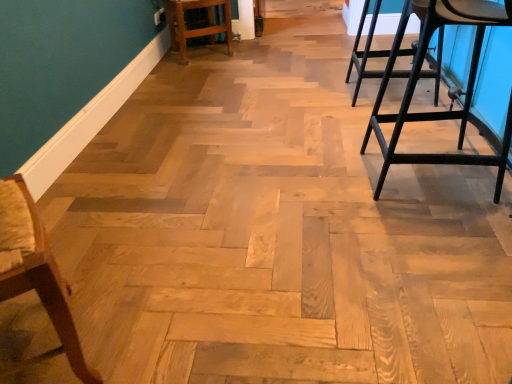
What do you see at coordinates (195, 27) in the screenshot? The width and height of the screenshot is (512, 384). I see `light brown wood bar stool at center` at bounding box center [195, 27].

Find the location of a particular element. light brown wood bar stool at center is located at coordinates (195, 27).

The image size is (512, 384). Identify the location of wooden chair at left. pyautogui.click(x=36, y=269).

What do you see at coordinates (36, 269) in the screenshot?
I see `wooden chair at left` at bounding box center [36, 269].

Where is `light brown wood bar stool at center`? The width and height of the screenshot is (512, 384). light brown wood bar stool at center is located at coordinates (195, 27).

Is light brown wood bar stool at center at the left side of wooden chair at left?

No, light brown wood bar stool at center is not to the left of wooden chair at left.

Which is behind, light brown wood bar stool at center or wooden chair at left?

light brown wood bar stool at center is further from the camera.

Is point (216, 27) closer to viewer compared to point (17, 224)?

That is False.

From the image's perspective, which is above, light brown wood bar stool at center or wooden chair at left?

light brown wood bar stool at center appears higher in the image.

From a real-world perspective, between light brown wood bar stool at center and wooden chair at left, who is vertically higher?

wooden chair at left, from a real-world perspective.

Can you confirm if light brown wood bar stool at center is wider than wooden chair at left?

Indeed, light brown wood bar stool at center has a greater width compared to wooden chair at left.

Can you confirm if light brown wood bar stool at center is taller than wooden chair at left?

No.

Is light brown wood bar stool at center smaller than wooden chair at left?

Actually, light brown wood bar stool at center might be larger than wooden chair at left.

Is light brown wood bar stool at center surrounding wooden chair at left?

No, wooden chair at left is not a part of light brown wood bar stool at center.

Is the surface of light brown wood bar stool at center in direct contact with wooden chair at left?

light brown wood bar stool at center and wooden chair at left are clearly separated.

Does light brown wood bar stool at center turn towards wooden chair at left?

No, light brown wood bar stool at center is not turned towards wooden chair at left.

How different are the orientations of light brown wood bar stool at center and wooden chair at left in degrees?

95.3 degrees separate the facing orientations of light brown wood bar stool at center and wooden chair at left.

You are a GUI agent. You are given a task and a screenshot of the screen. Output one action in this format:
    pyautogui.click(x=<x>, y=<y>)
    Task: Click on the chair lying in front of the light brown wood bar stool at center
    
    Given the screenshot: What is the action you would take?
    pyautogui.click(x=36, y=269)

Considering the relative positions of wooden chair at left and light brown wood bar stool at center in the image provided, is wooden chair at left to the left or to the right of light brown wood bar stool at center?

wooden chair at left is to the left of light brown wood bar stool at center.

In the image, is wooden chair at left positioned in front of or behind light brown wood bar stool at center?

Visually, wooden chair at left is located in front of light brown wood bar stool at center.

Considering the positions of point (4, 188) and point (220, 30), is point (4, 188) closer or farther from the camera than point (220, 30)?

Point (4, 188) is positioned closer to the camera compared to point (220, 30).

From the image's perspective, which is above, wooden chair at left or light brown wood bar stool at center?

light brown wood bar stool at center.

From a real-world perspective, is wooden chair at left beneath light brown wood bar stool at center?

No.

Between wooden chair at left and light brown wood bar stool at center, which one has smaller width?

Thinner between the two is wooden chair at left.

Is wooden chair at left taller or shorter than light brown wood bar stool at center?

wooden chair at left is taller than light brown wood bar stool at center.

Between wooden chair at left and light brown wood bar stool at center, which one has larger size?

Bigger between the two is light brown wood bar stool at center.

Choose the correct answer: Is wooden chair at left inside light brown wood bar stool at center or outside it?

wooden chair at left is spatially situated outside light brown wood bar stool at center.

Is wooden chair at left placed right next to light brown wood bar stool at center?

No, wooden chair at left is not touching light brown wood bar stool at center.

Is wooden chair at left aimed at light brown wood bar stool at center?

No, wooden chair at left is not facing towards light brown wood bar stool at center.

In the scene shown: How different are the orientations of wooden chair at left and light brown wood bar stool at center in degrees?

95.3 degrees.

Measure the distance from wooden chair at left to light brown wood bar stool at center.

wooden chair at left and light brown wood bar stool at center are 9.39 feet apart.

I want to click on bar stool lying behind the wooden chair at left, so click(195, 27).

The width and height of the screenshot is (512, 384). Identify the location of bar stool on the right side of wooden chair at left. (195, 27).

This screenshot has width=512, height=384. Find the location of `bar stool behind the wooden chair at left`. bar stool behind the wooden chair at left is located at coordinates [195, 27].